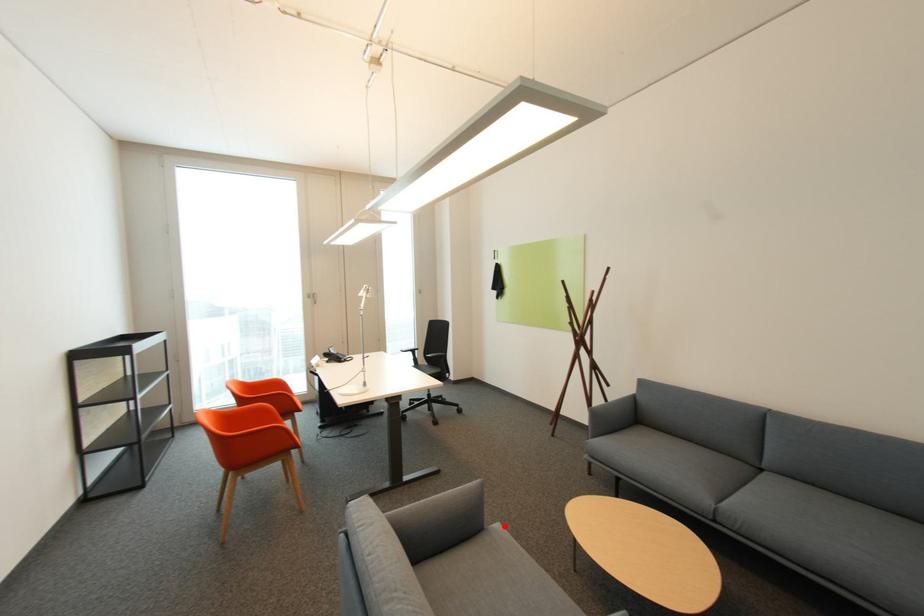
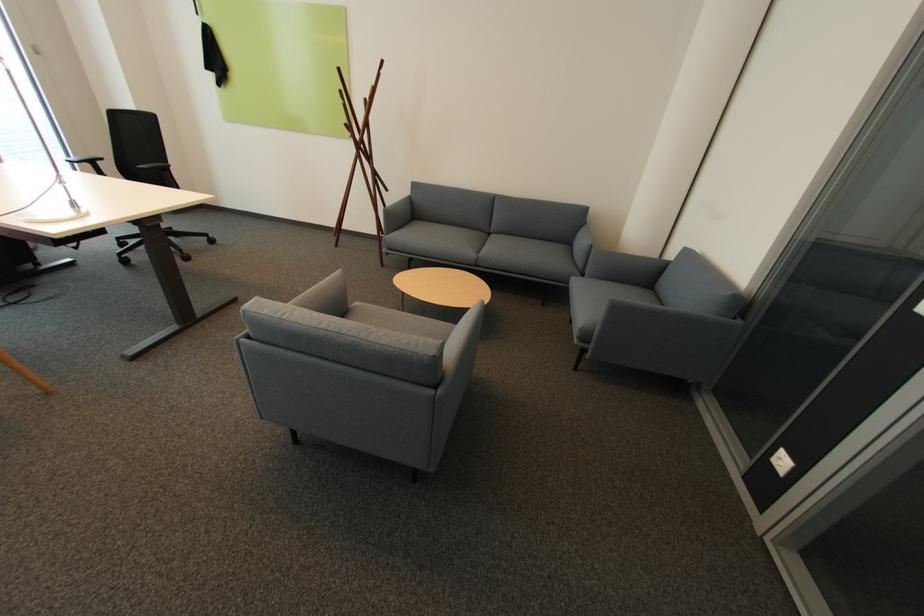
Question: I am providing you with two images of the same scene from different viewpoints. Image1 has a red point marked. In image2, the corresponding 3D location appears at what relative position? Reply with the corresponding letter.

Choices:
 (A) Closer
 (B) Farther

Answer: (B)